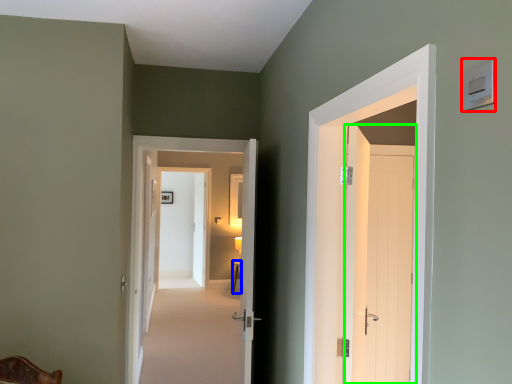
Question: Which object is positioned closest to light switch (highlighted by a red box)? Select from table (highlighted by a blue box) and door (highlighted by a green box).

Choices:
 (A) table
 (B) door

Answer: (B)